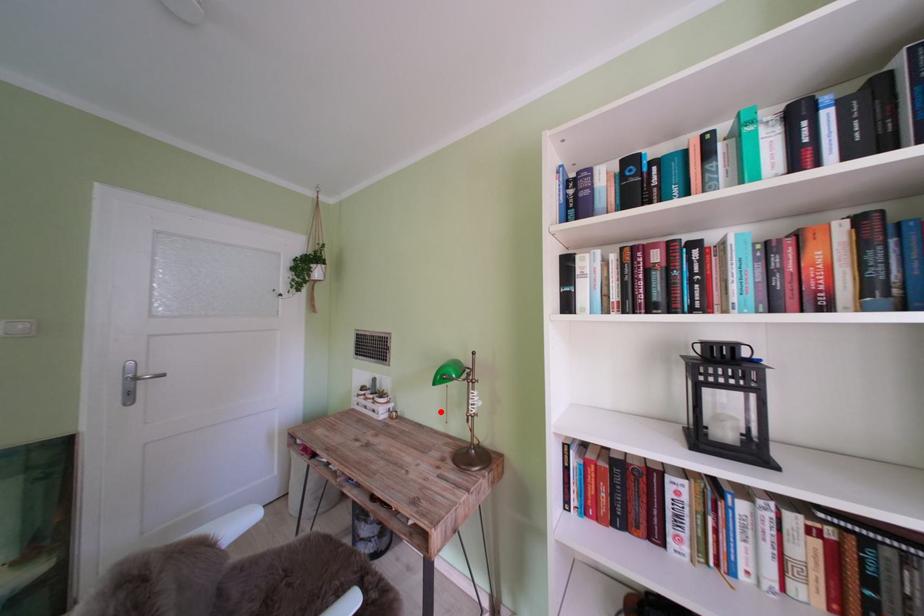
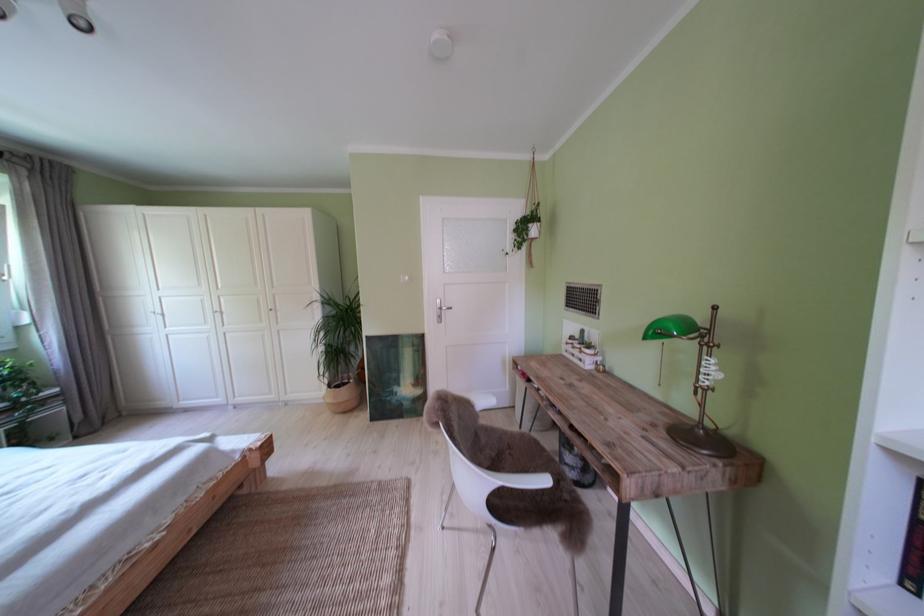
Question: I am providing you with two images of the same scene from different viewpoints. In image1, a red point is highlighted. Considering the same 3D point in image2, which of the following is correct?

Choices:
 (A) It is closer
 (B) It is farther

Answer: (A)